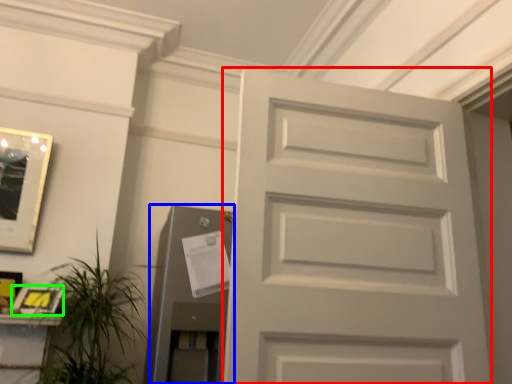
Question: Based on their relative distances, which object is farther from door (highlighted by a red box)? Choose from elevator (highlighted by a blue box) and picture frame (highlighted by a green box).

Choices:
 (A) elevator
 (B) picture frame

Answer: (B)